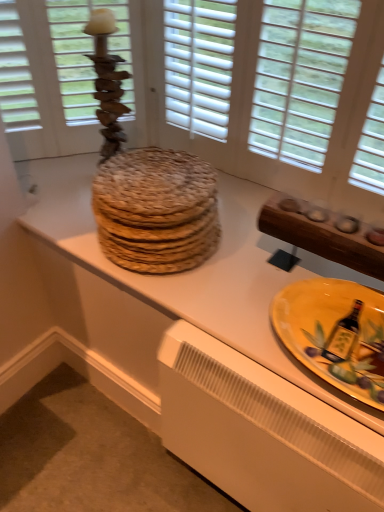
You are a GUI agent. You are given a task and a screenshot of the screen. Output one action in this format:
    pyautogui.click(x=<x>, y=<y>)
    Task: Click on the vacant space to the left of wooden candlestick at upper left
    The height and width of the screenshot is (512, 384).
    Given the screenshot: What is the action you would take?
    pyautogui.click(x=60, y=181)